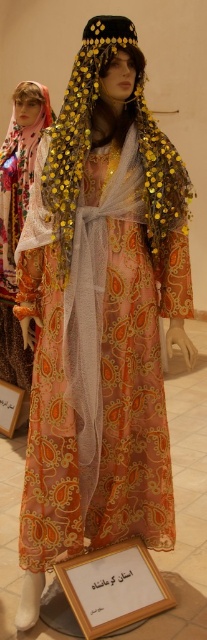
Question: Based on their relative distances, which object is farther from the matte white scarf at left?

Choices:
 (A) wooden plaque at lower center
 (B) white paper at center

Answer: (A)

Question: Considering the real-world distances, which object is farthest from the white paper at center?

Choices:
 (A) matte white scarf at left
 (B) wooden plaque at lower center

Answer: (B)

Question: Does matte white scarf at left have a greater width compared to white paper at center?

Choices:
 (A) no
 (B) yes

Answer: (B)

Question: Which point is farther to the camera?

Choices:
 (A) matte white scarf at left
 (B) wooden plaque at lower center

Answer: (A)

Question: Can you confirm if wooden plaque at lower center is bigger than white paper at center?

Choices:
 (A) yes
 (B) no

Answer: (A)

Question: Does matte white scarf at left have a lesser width compared to wooden plaque at lower center?

Choices:
 (A) no
 (B) yes

Answer: (B)